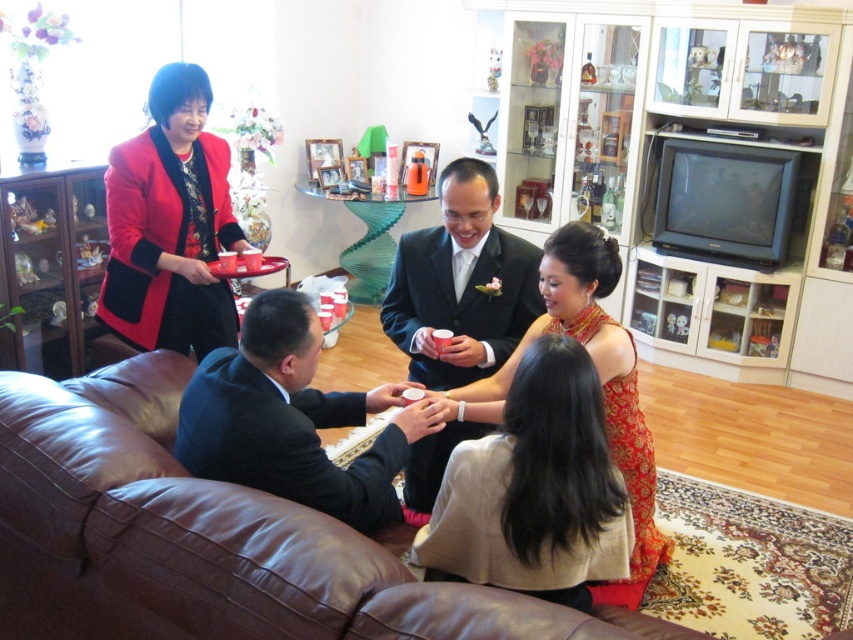
Which is below, brown leather couch at lower left or matte red blazer at left?

brown leather couch at lower left is lower down.

Is brown leather couch at lower left bigger than matte red blazer at left?

Yes.

Does point (259, 545) come behind point (195, 349)?

No, it is in front of (195, 349).

This screenshot has width=853, height=640. I want to click on brown leather couch at lower left, so click(206, 540).

Image resolution: width=853 pixels, height=640 pixels. Find the location of `brown leather couch at lower left`. brown leather couch at lower left is located at coordinates (206, 540).

Does brown leather couch at lower left appear under silk red dress at center?

Correct, brown leather couch at lower left is located below silk red dress at center.

In order to click on brown leather couch at lower left in this screenshot , I will do `click(206, 540)`.

Can you confirm if dark blue suit at center is taller than shiny black suit at center?

No, dark blue suit at center is not taller than shiny black suit at center.

Based on the photo, measure the distance between point (218, 406) and camera.

Point (218, 406) is 5.84 feet away from camera.

This screenshot has width=853, height=640. Identify the location of dark blue suit at center. (292, 419).